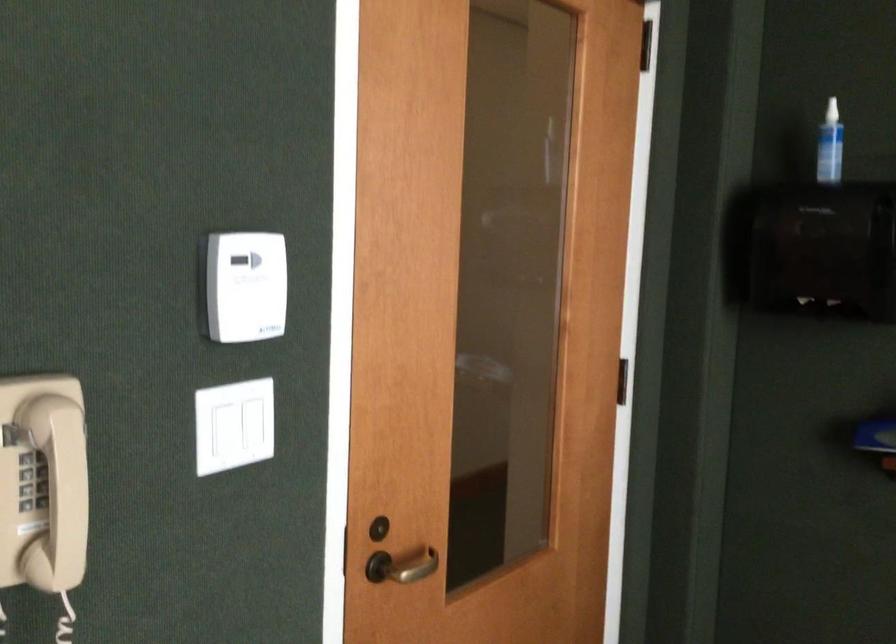
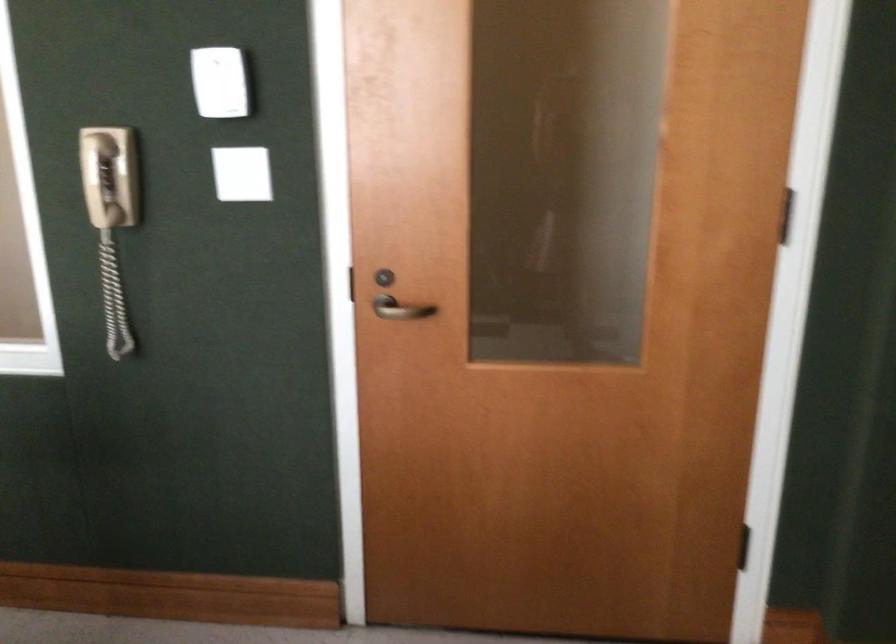
Locate, in the second image, the point that corresponds to point 74,476 in the first image.

(99, 180)